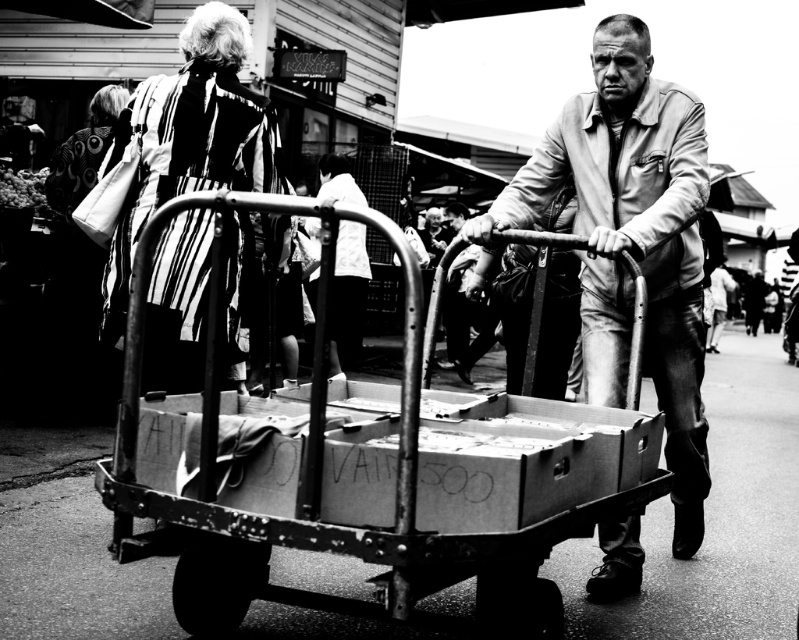
Is metallic cart at center below matte leather jacket at center?

Yes, metallic cart at center is below matte leather jacket at center.

Is point (523, 433) closer to camera compared to point (515, 189)?

Yes, it is in front of point (515, 189).

I want to click on metallic cart at center, so click(360, 472).

Between matte leather jacket at center and striped fabric coat at upper left, which one appears on the right side from the viewer's perspective?

matte leather jacket at center is more to the right.

What do you see at coordinates (631, 241) in the screenshot? The image size is (799, 640). I see `matte leather jacket at center` at bounding box center [631, 241].

You are a GUI agent. You are given a task and a screenshot of the screen. Output one action in this format:
    pyautogui.click(x=<x>, y=<y>)
    Task: Click on the matte leather jacket at center
    This screenshot has height=640, width=799.
    Given the screenshot: What is the action you would take?
    pyautogui.click(x=631, y=241)

How far apart are striped fabric coat at upper left and white fabric shirt at center?

striped fabric coat at upper left is 11.24 feet from white fabric shirt at center.

At what (x,y) coordinates should I click in order to perform the action: click on striped fabric coat at upper left. Please return your answer as a coordinate pair (x, y). The height and width of the screenshot is (640, 799). Looking at the image, I should click on (189, 140).

At what (x,y) coordinates should I click in order to perform the action: click on striped fabric coat at upper left. Please return your answer as a coordinate pair (x, y). This screenshot has height=640, width=799. Looking at the image, I should click on (189, 140).